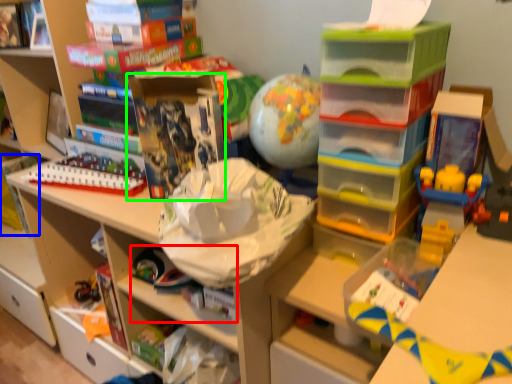
Question: Based on their relative distances, which object is farther from book (highlighted by a red box)? Choose from book (highlighted by a blue box) and book (highlighted by a green box).

Choices:
 (A) book
 (B) book

Answer: (A)